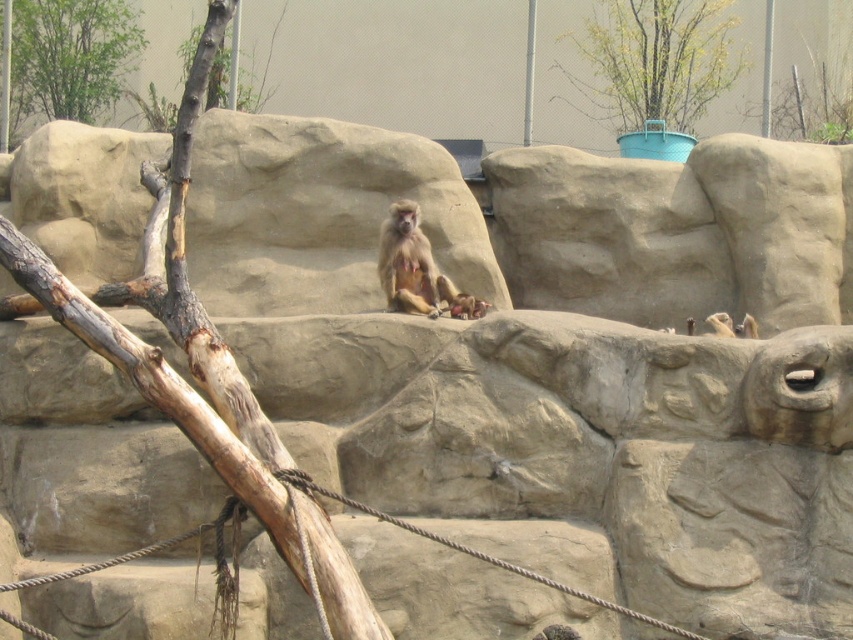
Question: From the image, what is the correct spatial relationship of golden fur monkey at center in relation to furry brown monkey at center?

Choices:
 (A) below
 (B) above

Answer: (B)

Question: Is golden fur monkey at center closer to camera compared to brown furry monkey at center?

Choices:
 (A) yes
 (B) no

Answer: (A)

Question: Where is green plastic pot at upper center located in relation to golden fur monkey at center in the image?

Choices:
 (A) below
 (B) above

Answer: (B)

Question: Which of the following is the closest to the observer?

Choices:
 (A) green leafy tree at upper left
 (B) golden fur monkey at center
 (C) green plastic pot at upper center
 (D) furry brown monkey at center

Answer: (B)

Question: Which object is farther from the camera taking this photo?

Choices:
 (A) golden fur monkey at center
 (B) green leafy tree at upper left
 (C) brown furry monkey at center
 (D) green plastic pot at upper center

Answer: (B)

Question: Which point appears closest to the camera in this image?

Choices:
 (A) (424, 289)
 (B) (683, 124)

Answer: (A)